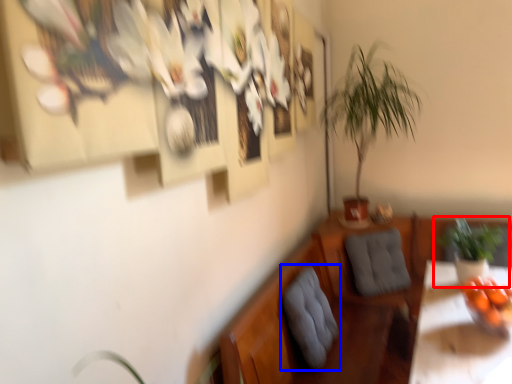
Question: Which object appears closest to the camera in this image, houseplant (highlighted by a red box) or swivel chair (highlighted by a blue box)?

Choices:
 (A) houseplant
 (B) swivel chair

Answer: (B)